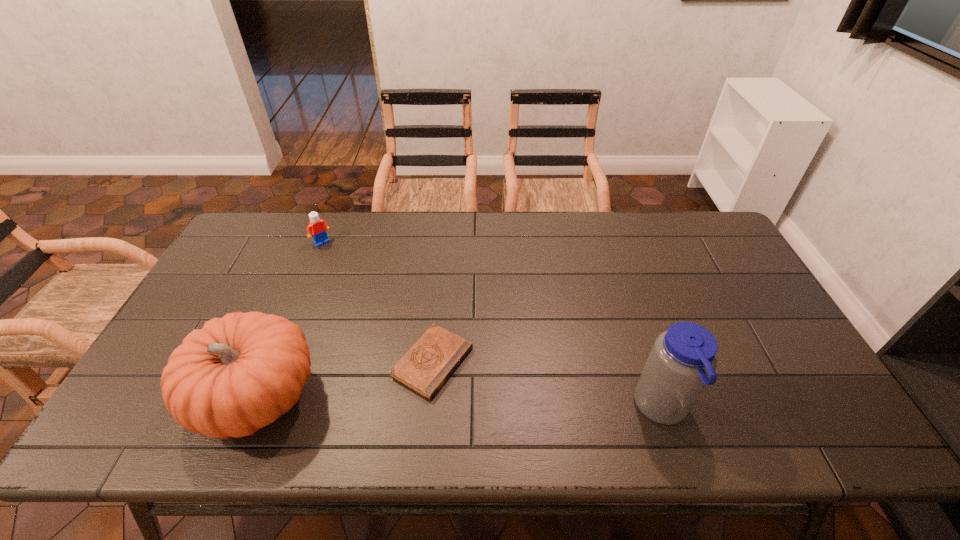
The width and height of the screenshot is (960, 540). What are the coordinates of `vacant region at the far edge of the desktop` in the screenshot? It's located at (542, 214).

Find the location of `vacant area at the near edge of the desktop`. vacant area at the near edge of the desktop is located at coordinates coord(343,406).

At what (x,y) coordinates should I click in order to perform the action: click on vacant region at the left edge of the desktop. Please return your answer as a coordinate pair (x, y). Looking at the image, I should click on (175, 333).

At what (x,y) coordinates should I click in order to perform the action: click on vacant area at the far left corner. Please return your answer as a coordinate pair (x, y). The height and width of the screenshot is (540, 960). Looking at the image, I should click on (238, 241).

Identify the location of free point at the far right corner. (724, 239).

Locate an element on the screen. The image size is (960, 540). free space between the pumpkin and the tallest object is located at coordinates (460, 403).

Where is `vacant area between the shortest object and the farthest object`? vacant area between the shortest object and the farthest object is located at coordinates (377, 302).

In order to click on vacant point located between the second tallest object and the diary in this screenshot , I will do `click(345, 380)`.

Find the location of `vacant area that lies between the farthest object and the rightmost object`. vacant area that lies between the farthest object and the rightmost object is located at coordinates coord(492,325).

Find the location of `vacant area that lies between the farthest object and the rightmost object`. vacant area that lies between the farthest object and the rightmost object is located at coordinates (492, 325).